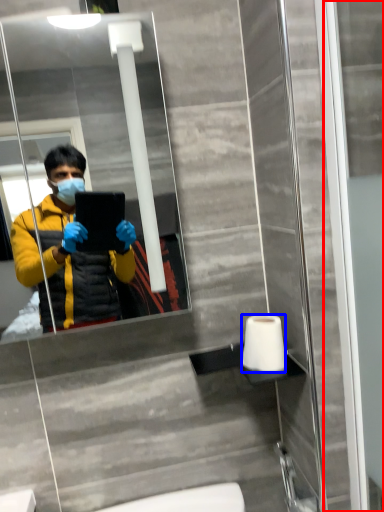
Question: Which object appears closest to the camera in this image, screen door (highlighted by a red box) or toilet paper (highlighted by a blue box)?

Choices:
 (A) screen door
 (B) toilet paper

Answer: (A)